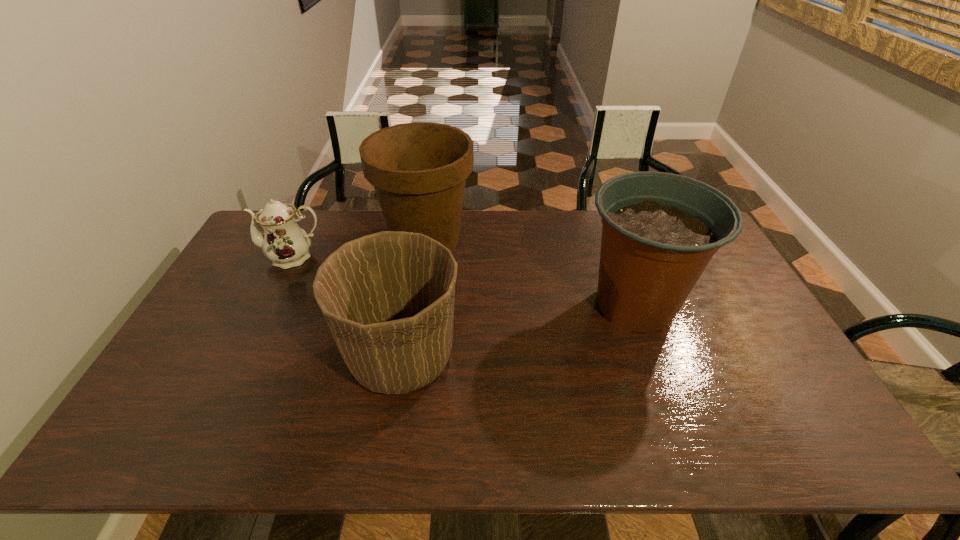
I want to click on the rightmost object, so click(660, 230).

Image resolution: width=960 pixels, height=540 pixels. What are the coordinates of `the leftmost object` in the screenshot? It's located at (284, 242).

You are a GUI agent. You are given a task and a screenshot of the screen. Output one action in this format:
    pyautogui.click(x=<x>, y=<y>)
    Task: Click on the shortest object
    This screenshot has height=540, width=960.
    Given the screenshot: What is the action you would take?
    pyautogui.click(x=284, y=242)

Where is `free space located on the front of the rightmost flowerpot`? The image size is (960, 540). free space located on the front of the rightmost flowerpot is located at coordinates (658, 371).

Image resolution: width=960 pixels, height=540 pixels. In order to click on free space located 0.340m on the front of the leftmost object in this screenshot , I will do `click(246, 355)`.

Locate an element on the screen. The image size is (960, 540). flowerpot that is at the far edge is located at coordinates (419, 170).

Find the location of a particular element. chinaware that is at the far edge is located at coordinates (284, 242).

Locate an element on the screen. The width and height of the screenshot is (960, 540). object located at the left edge is located at coordinates (284, 242).

You are a GUI agent. You are given a task and a screenshot of the screen. Output one action in this format:
    pyautogui.click(x=<x>, y=<y>)
    Task: Click on the object that is at the far left corner
    This screenshot has height=540, width=960.
    Given the screenshot: What is the action you would take?
    pyautogui.click(x=284, y=242)

Image resolution: width=960 pixels, height=540 pixels. I want to click on blank space at the far edge, so pyautogui.click(x=320, y=227).